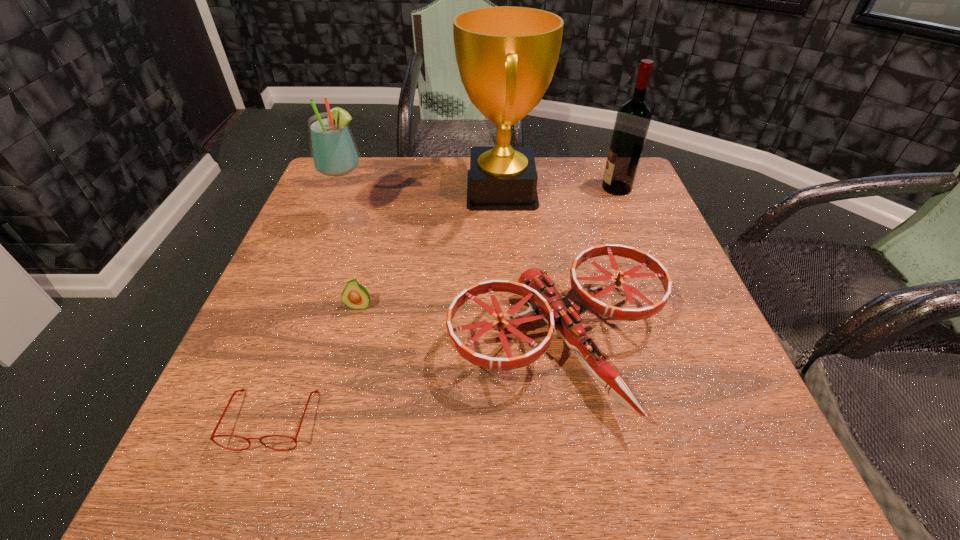
I want to click on alcohol that is positioned at the right edge, so click(633, 118).

The image size is (960, 540). I want to click on drone that is at the right edge, so click(x=562, y=313).

Find the location of a particular element. object at the near left corner is located at coordinates (242, 390).

In order to click on object positioned at the far right corner in this screenshot , I will do (x=633, y=118).

The image size is (960, 540). In the image, there is a desktop. What are the coordinates of `free space at the far edge` in the screenshot? It's located at (428, 160).

In the image, there is a desktop. Identify the location of vacant area at the left edge. This screenshot has width=960, height=540. (304, 231).

What are the coordinates of `free space at the right edge of the desktop` in the screenshot? It's located at (722, 379).

At what (x,y) coordinates should I click in order to perform the action: click on vacant point at the far left corner. Please return your answer as a coordinate pair (x, y). This screenshot has width=960, height=540. Looking at the image, I should click on (355, 183).

You are a GUI agent. You are given a task and a screenshot of the screen. Output one action in this format:
    pyautogui.click(x=<x>, y=<y>)
    Task: Click on the empty space between the right alcohol and the shortest object
    
    Given the screenshot: What is the action you would take?
    click(444, 303)

Locate an element on the screen. The height and width of the screenshot is (540, 960). free space between the right alcohol and the drone is located at coordinates (588, 267).